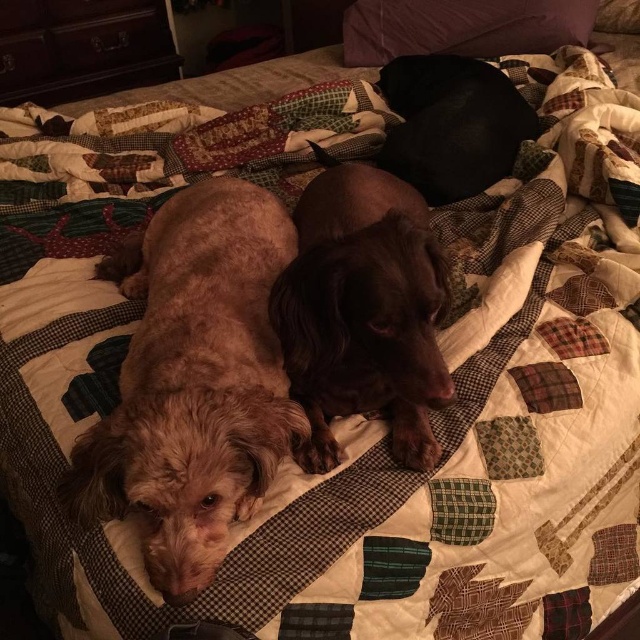
You are a dog owner who wants to place a 30 inch long blanket between the fuzzy brown dog at center and the black smooth dog at upper center. Can the blanket fit between them without overlapping either dog?

The distance between the fuzzy brown dog at center and the black smooth dog at upper center is 29.29 inches. Since the blanket is 30 inches long, it is slightly longer than the space between them. Therefore, the blanket cannot fit without overlapping one or both dogs.

You are looking at the bed with two dogs resting on it. There are two points marked on the bed. Which point is closer to you, point (83, 483) or point (460, 168)?

Point (83, 483) is closer to the viewer than point (460, 168).

Looking at this image, you are standing at point point (436, 113) and want to take a photo of the two dogs resting on the bed. The camera you are using has a maximum focus distance of 1.5 meters. Will the camera be able to focus on the dogs?

The distance between point (436, 113) and the camera is 1.61 meters, which exceeds the camera maximum focus distance of 1.5 meters. Therefore, the camera will not be able to focus on the dogs.